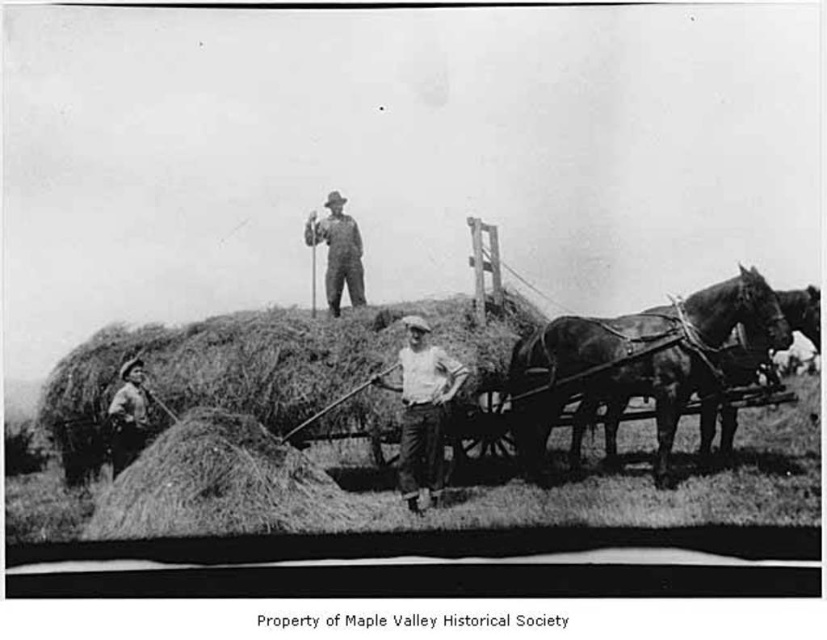
Which is in front, point (434, 500) or point (123, 429)?

Point (434, 500)

Is white cotton shirt at center shorter than rugged brown leather jacket at lower left?

Incorrect, white cotton shirt at center's height does not fall short of rugged brown leather jacket at lower left's.

Does point (405, 400) come behind point (125, 454)?

No, it is not.

At what (x,y) coordinates should I click in order to perform the action: click on white cotton shirt at center. Please return your answer as a coordinate pair (x, y). This screenshot has width=827, height=640. Looking at the image, I should click on (422, 410).

Is dark brown glossy horse at right taller than overalls at center?

Yes, dark brown glossy horse at right is taller than overalls at center.

Find the location of a particular element. The height and width of the screenshot is (640, 827). dark brown glossy horse at right is located at coordinates (634, 364).

You are a GUI agent. You are given a task and a screenshot of the screen. Output one action in this format:
    pyautogui.click(x=<x>, y=<y>)
    Task: Click on the dark brown glossy horse at right
    The image size is (827, 640).
    Given the screenshot: What is the action you would take?
    pyautogui.click(x=634, y=364)

Which is more to the right, overalls at center or rugged brown leather jacket at lower left?

Positioned to the right is overalls at center.

Is point (343, 216) positioned after point (131, 403)?

Yes, point (343, 216) is behind point (131, 403).

The image size is (827, 640). What are the coordinates of `overalls at center` in the screenshot? It's located at (338, 252).